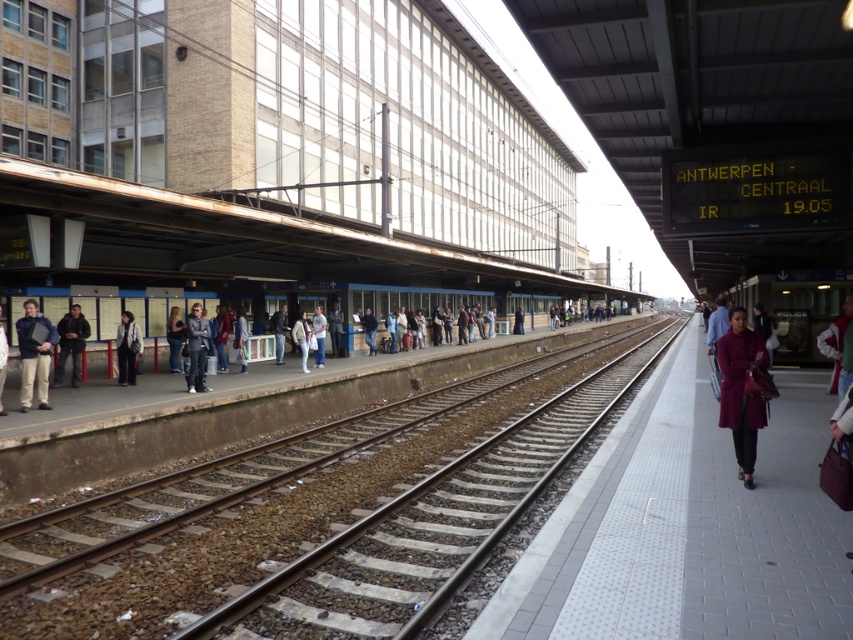
You are standing on the platform and see the gray fabric jacket at center. If you want to reach it in 5 seconds, what is the minimum speed you need to walk at?

The gray fabric jacket at center is 13.94 meters away. To cover that distance in 5 seconds, you need to walk at a minimum speed of 2.79 meters per second.

You are standing on the platform and want to give a dark blue jacket at left to someone who is 5 feet tall. Can they reach it?

The dark blue jacket at left and viewer are 47.60 feet apart, so the person who is 5 feet tall cannot reach it because the distance is too far.